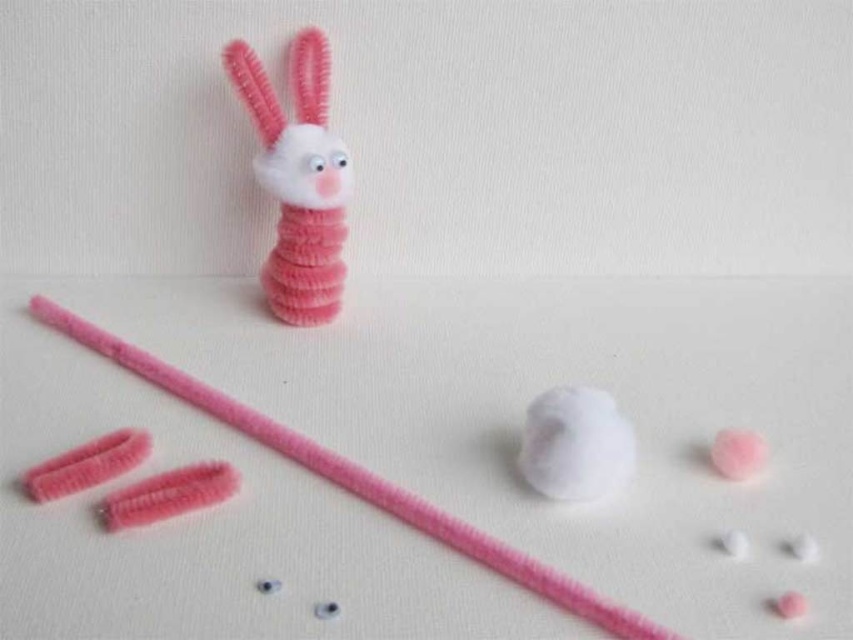
Is matte pink pipe cleaner at center bigger than fuzzy pink pipe cleaner at center?

Actually, matte pink pipe cleaner at center might be smaller than fuzzy pink pipe cleaner at center.

Measure the distance between point (299, 88) and camera.

Point (299, 88) is 1.45 meters from camera.

Image resolution: width=853 pixels, height=640 pixels. What are the coordinates of `matte pink pipe cleaner at center` in the screenshot? It's located at (299, 179).

This screenshot has height=640, width=853. What do you see at coordinates (299, 179) in the screenshot?
I see `matte pink pipe cleaner at center` at bounding box center [299, 179].

Is point (248, 45) closer to camera compared to point (523, 476)?

No, (248, 45) is behind (523, 476).

Locate an element on the screen. Image resolution: width=853 pixels, height=640 pixels. matte pink pipe cleaner at center is located at coordinates (299, 179).

From the picture: Does fuzzy pink pipe cleaner at center have a lesser width compared to white fluffy ball at center?

No, fuzzy pink pipe cleaner at center is not thinner than white fluffy ball at center.

Image resolution: width=853 pixels, height=640 pixels. What do you see at coordinates (355, 477) in the screenshot?
I see `fuzzy pink pipe cleaner at center` at bounding box center [355, 477].

Locate an element on the screen. The width and height of the screenshot is (853, 640). fuzzy pink pipe cleaner at center is located at coordinates (355, 477).